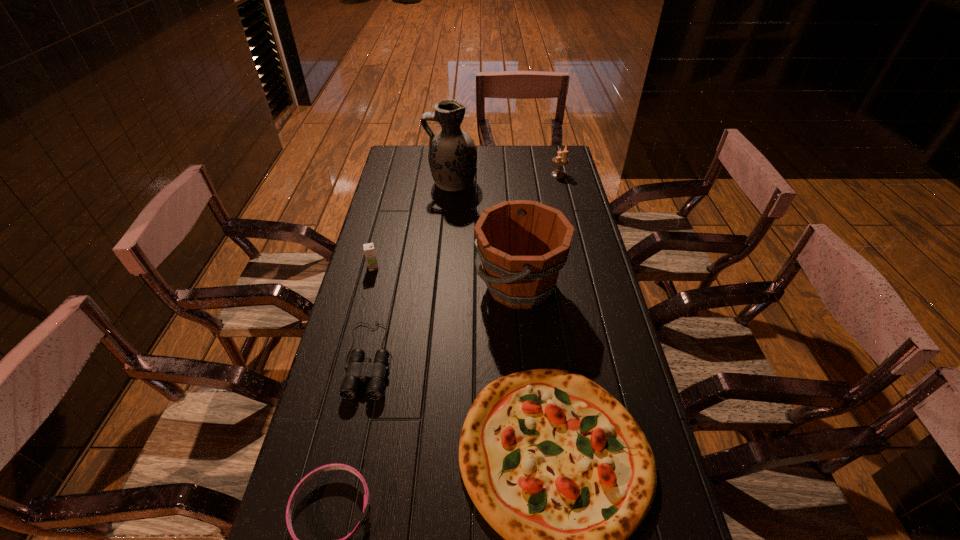
Where is `object that is at the far right corner`? object that is at the far right corner is located at coordinates (559, 160).

Find the location of a particular element. vacant space at the far edge of the desktop is located at coordinates (504, 169).

The height and width of the screenshot is (540, 960). In the image, there is a desktop. Identify the location of blank space at the left edge. (387, 204).

The width and height of the screenshot is (960, 540). In order to click on free space at the right edge in this screenshot , I will do `click(555, 193)`.

Locate an element on the screen. vacant space at the far left corner of the desktop is located at coordinates (423, 168).

Where is `vacant area at the far right corner`? The width and height of the screenshot is (960, 540). vacant area at the far right corner is located at coordinates (541, 156).

Where is `free area in between the vase and the binoculars`? The height and width of the screenshot is (540, 960). free area in between the vase and the binoculars is located at coordinates click(411, 271).

You are a GUI agent. You are given a task and a screenshot of the screen. Output one action in this format:
    pyautogui.click(x=<x>, y=<y>)
    Task: Click on the free point between the fifth shortest object and the binoculars
    This screenshot has height=540, width=960.
    Given the screenshot: What is the action you would take?
    pyautogui.click(x=464, y=267)

You are a GUI agent. You are given a task and a screenshot of the screen. Output one action in this format:
    pyautogui.click(x=<x>, y=<y>)
    Task: Click on the vacant region between the chocolate milk and the binoculars
    This screenshot has width=960, height=540.
    Given the screenshot: What is the action you would take?
    pyautogui.click(x=372, y=313)

Where is `free spot between the fifth shortest object and the tallest object`? The width and height of the screenshot is (960, 540). free spot between the fifth shortest object and the tallest object is located at coordinates (505, 179).